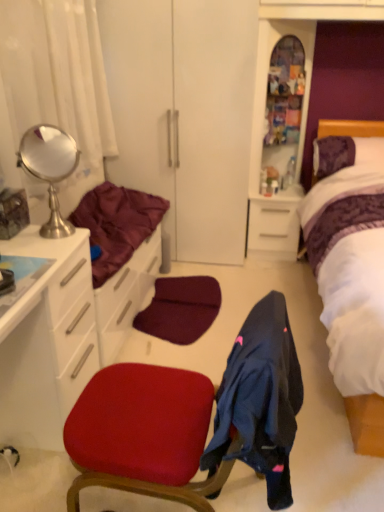
In order to click on free space in front of polished silver mirror at upper left in this screenshot , I will do `click(45, 253)`.